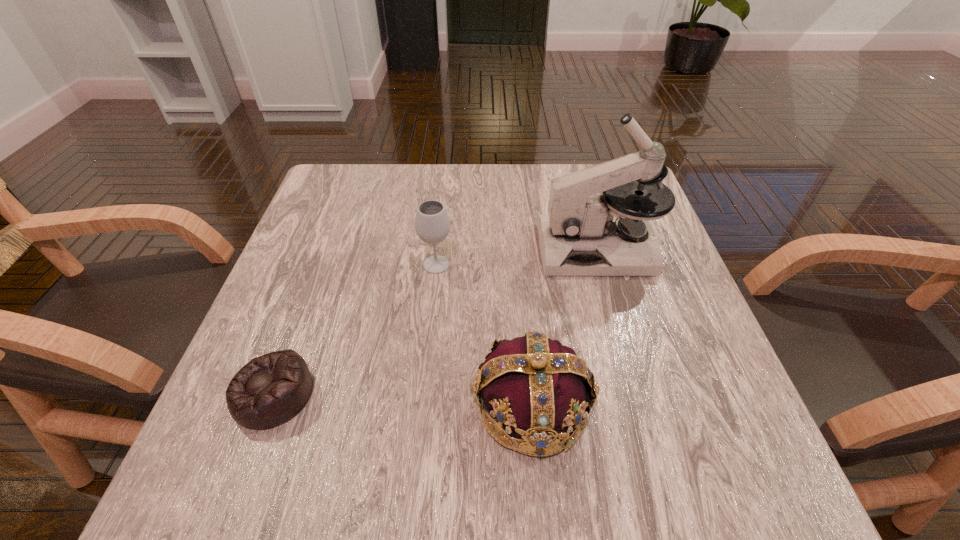
You are a GUI agent. You are given a task and a screenshot of the screen. Output one action in this format:
    pyautogui.click(x=<x>, y=<y>)
    Task: Click on the tallest object
    
    Given the screenshot: What is the action you would take?
    pyautogui.click(x=581, y=235)

Locate an element on the screen. The width and height of the screenshot is (960, 540). the second object from left to right is located at coordinates (432, 224).

Where is `crown`? crown is located at coordinates (536, 386).

Where is `the shortest object`? the shortest object is located at coordinates (270, 390).

Locate an element on the screen. This screenshot has width=960, height=540. beanbag is located at coordinates (270, 390).

At what (x,y) coordinates should I click in order to perform the action: click on vacant space situated at the eyepiece of the tallest object. Please return your answer as a coordinate pair (x, y). The image size is (960, 540). Looking at the image, I should click on (399, 249).

The height and width of the screenshot is (540, 960). Find the location of `free region located 0.330m at the eyepiece of the tallest object`. free region located 0.330m at the eyepiece of the tallest object is located at coordinates (390, 249).

Where is `vacant space situated 0.180m at the eyepiece of the tallest object`? Image resolution: width=960 pixels, height=540 pixels. vacant space situated 0.180m at the eyepiece of the tallest object is located at coordinates (459, 249).

The image size is (960, 540). In order to click on vacant area situated 0.210m on the front of the wineglass in this screenshot , I will do `click(426, 362)`.

Locate an element on the screen. vacant position located 0.400m on the back of the crown is located at coordinates (515, 217).